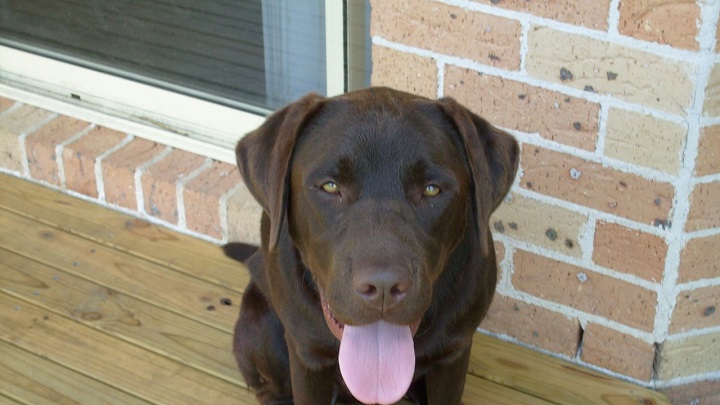
The image size is (720, 405). I want to click on window blinds, so click(248, 39).